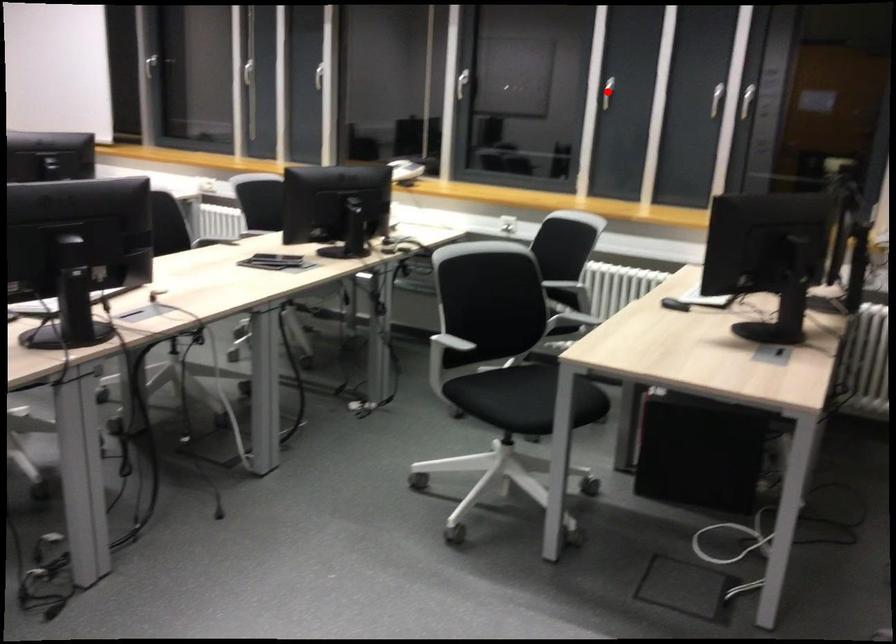
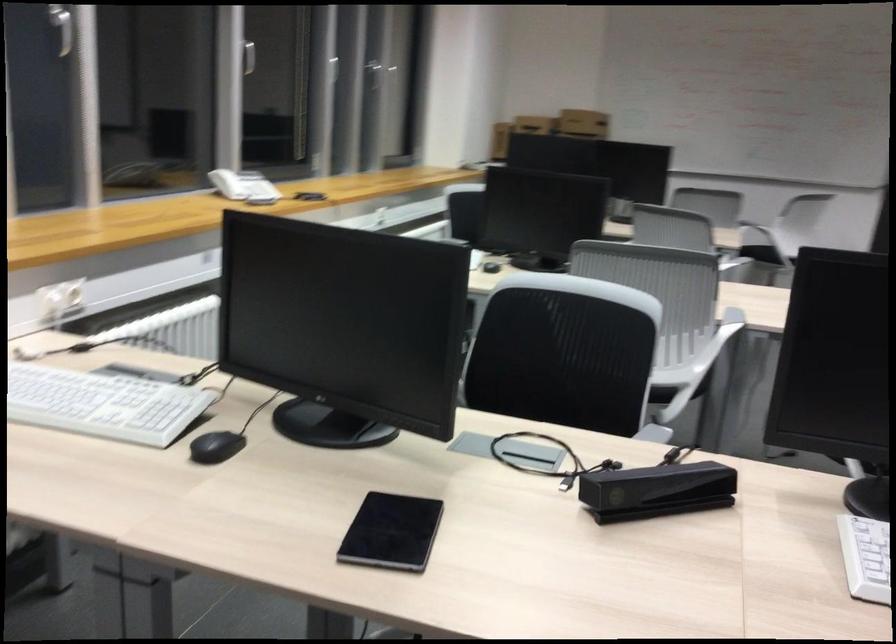
Question: I am providing you with two images of the same scene from different viewpoints. A red point is marked on the first image. Is the red point's position out of view in image 2?

Choices:
 (A) Yes
 (B) No

Answer: (A)